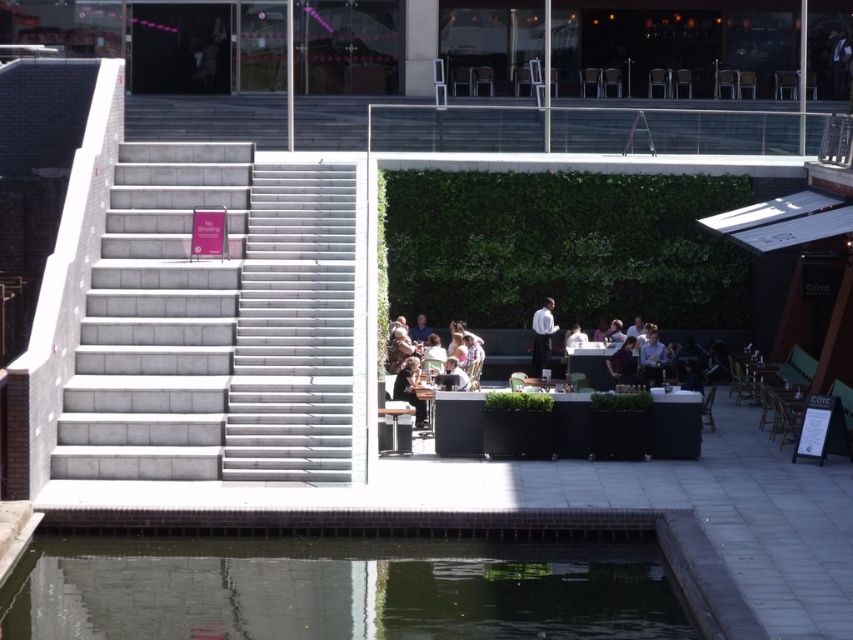
You are a person who is 1.7 meters tall. You are standing at the center of the image and see the matte black chair at center and the light brown leather jacket at center. Which object is closer to your eye level?

The light brown leather jacket at center is taller than the matte black chair at center, so the light brown leather jacket at center is closer to your eye level.

You are standing at the center of the pool and want to reach the gray concrete stairs at left. Which direction should you walk to get there?

You should walk towards the left direction to reach the gray concrete stairs at left since they are positioned at point (213, 323), which is to the left side of the scene.